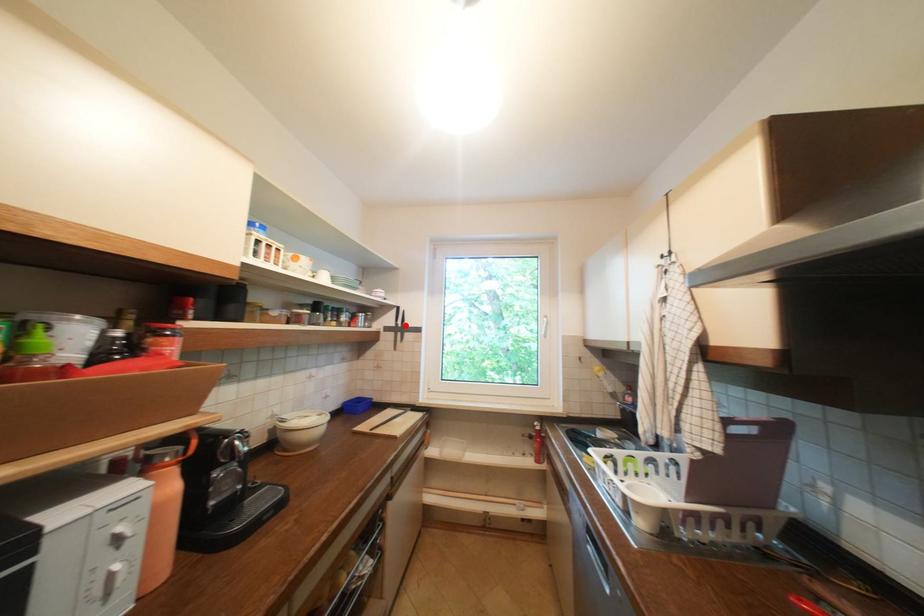
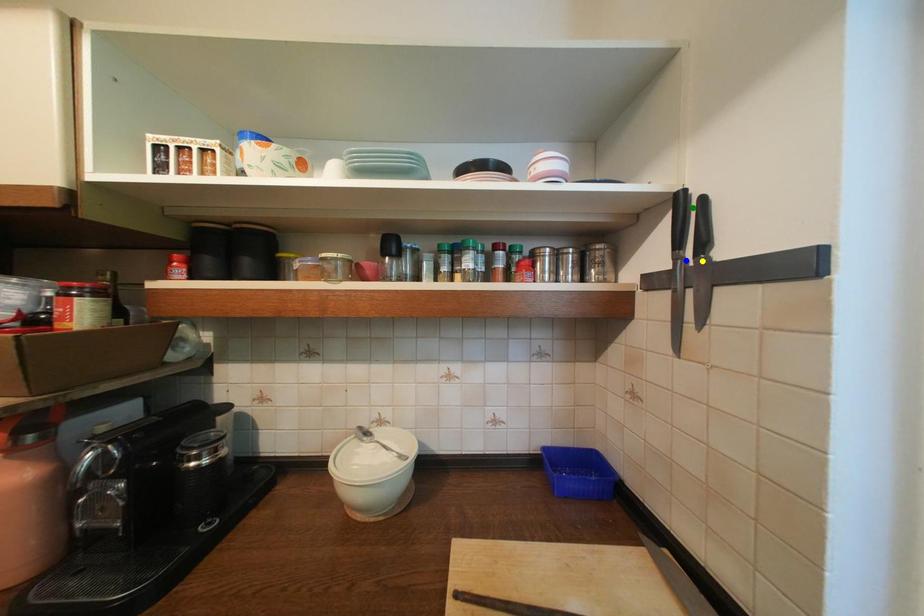
Question: I am providing you with two images of the same scene from different viewpoints. A red point is marked on the first image. You are given multiple points on the second image. Which point in image 2 is actually the same real-world point as the red point in image 1?

Choices:
 (A) blue point
 (B) yellow point
 (C) green point

Answer: (A)